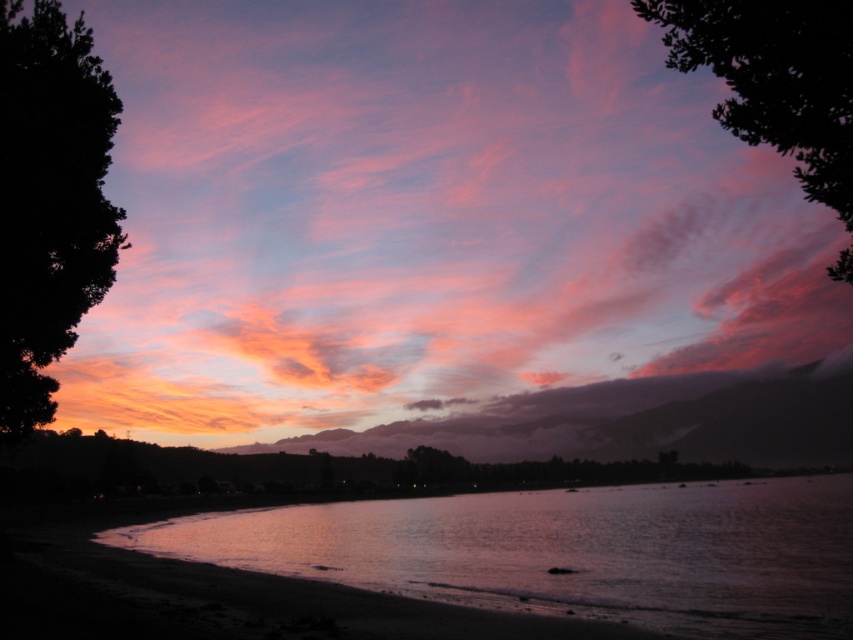
Question: Which of the following is the closest to the observer?

Choices:
 (A) dark green leafy tree at upper right
 (B) pink glossy water at lower left
 (C) silhouette tree at left

Answer: (A)

Question: Does silhouette tree at left have a lesser width compared to dark green leafy tree at upper right?

Choices:
 (A) yes
 (B) no

Answer: (A)

Question: Which object is positioned farthest from the dark green leafy tree at upper right?

Choices:
 (A) silhouette tree at left
 (B) pink glossy water at lower left

Answer: (B)

Question: Based on their relative distances, which object is nearer to the dark green leafy tree at upper right?

Choices:
 (A) pink glossy water at lower left
 (B) silhouette tree at left

Answer: (B)

Question: Can you confirm if pink glossy water at lower left is wider than silhouette tree at left?

Choices:
 (A) no
 (B) yes

Answer: (B)

Question: Does silhouette tree at left have a greater width compared to dark green leafy tree at upper right?

Choices:
 (A) yes
 (B) no

Answer: (B)